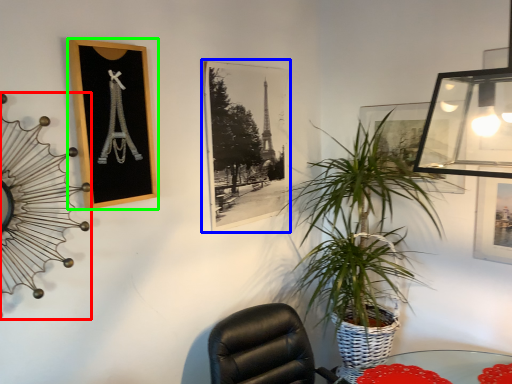
Question: Which object is positioned farthest from clock (highlighted by a red box)? Select from picture frame (highlighted by a blue box) and picture frame (highlighted by a green box).

Choices:
 (A) picture frame
 (B) picture frame

Answer: (A)